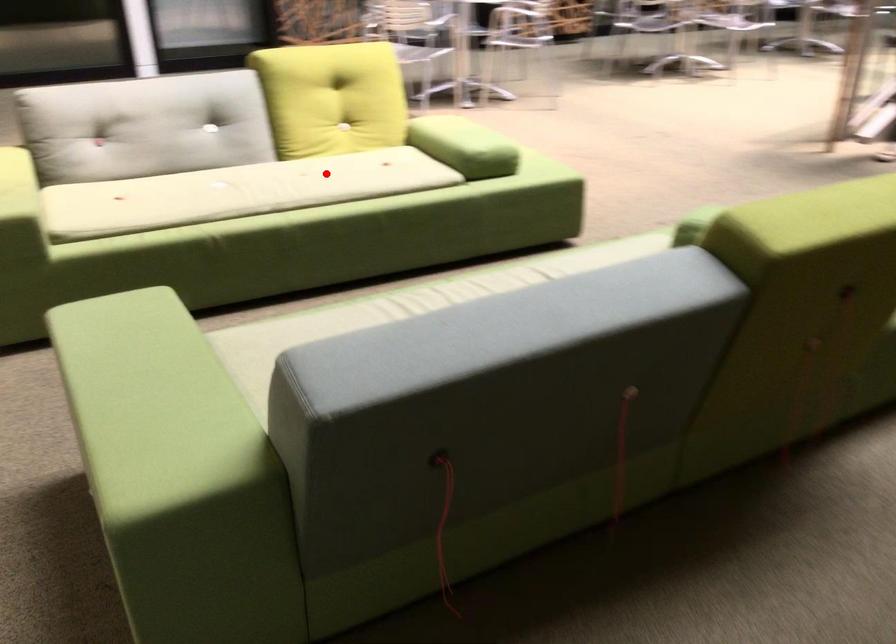
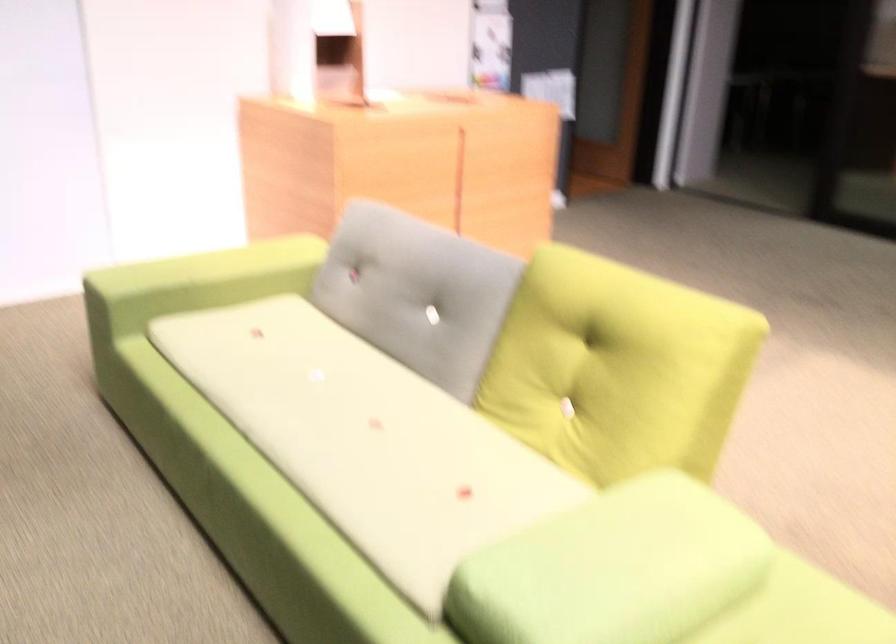
Question: I am providing you with two images of the same scene from different viewpoints. Image1 has a red point marked. In image2, the corresponding 3D location appears at what relative position? Reply with the corresponding letter.

Choices:
 (A) Closer
 (B) Farther

Answer: (A)